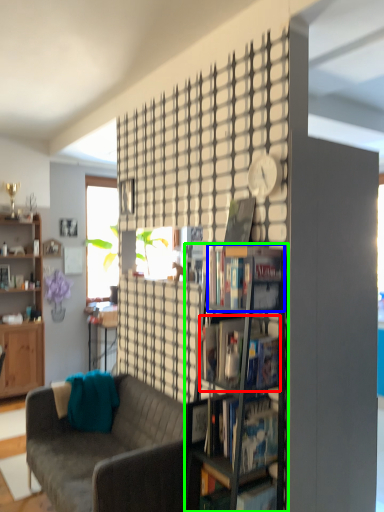
Question: Which object is positioned closest to book (highlighted by a red box)? Select from book (highlighted by a blue box) and shelf (highlighted by a green box).

Choices:
 (A) book
 (B) shelf

Answer: (B)